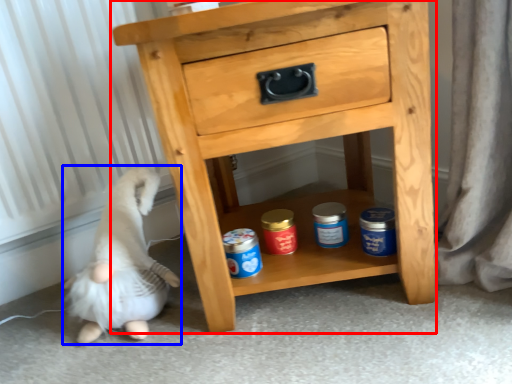
Question: Among these objects, which one is farthest to the camera, chest of drawers (highlighted by a red box) or animal (highlighted by a blue box)?

Choices:
 (A) chest of drawers
 (B) animal

Answer: (B)